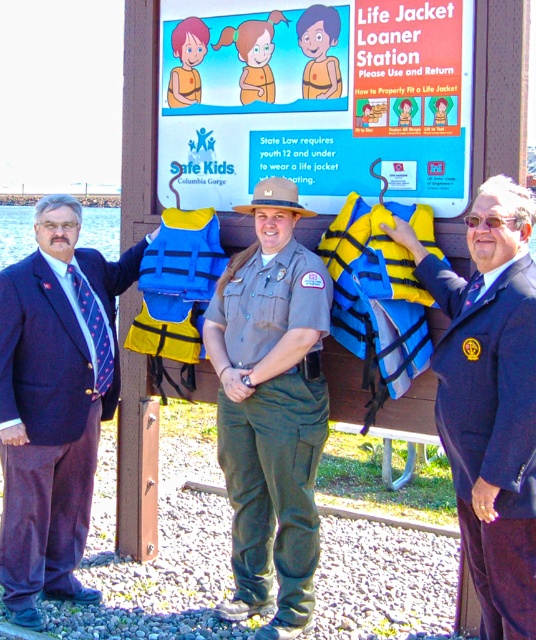
Question: In this image, where is yellow life jacket at center located relative to orange life jacket at center?

Choices:
 (A) above
 (B) below

Answer: (B)

Question: Which point is farther to the camera?

Choices:
 (A) click(366, 180)
 (B) click(452, 289)

Answer: (A)

Question: Which object is closer to the camera taking this photo?

Choices:
 (A) khaki uniform at center
 (B) matte yellow life jacket at center
 (C) matte plastic sign at upper center

Answer: (C)

Question: Does matte plastic sign at upper center have a lesser width compared to blue fabric life jacket at right?

Choices:
 (A) no
 (B) yes

Answer: (A)

Question: From the image, what is the correct spatial relationship of khaki uniform at center in relation to yellow life jacket at center?

Choices:
 (A) right
 (B) left

Answer: (B)

Question: Among these objects, which one is nearest to the camera?

Choices:
 (A) matte plastic sign at upper center
 (B) blue fabric life jacket at right
 (C) yellow life jacket at center
 (D) blue/yellow life jacket at center

Answer: (B)